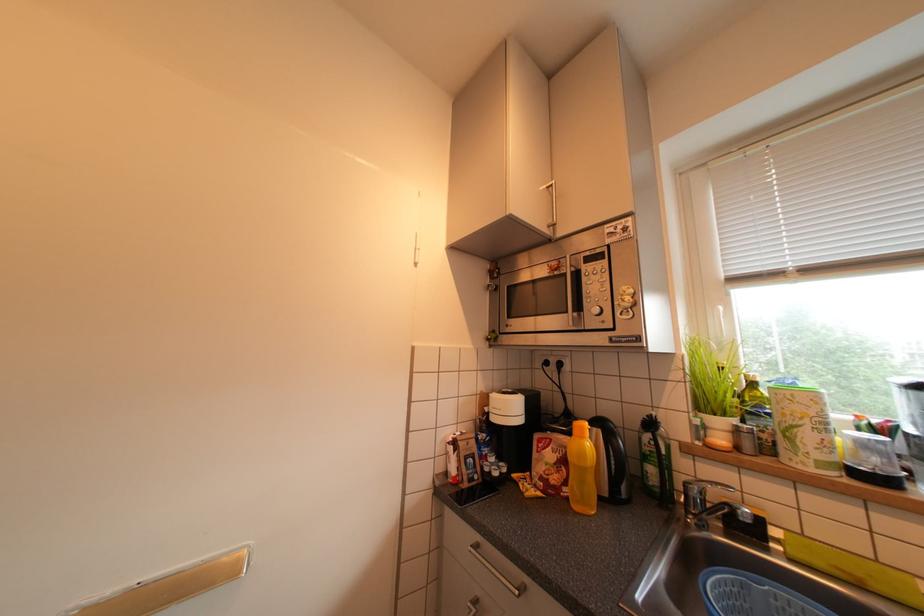
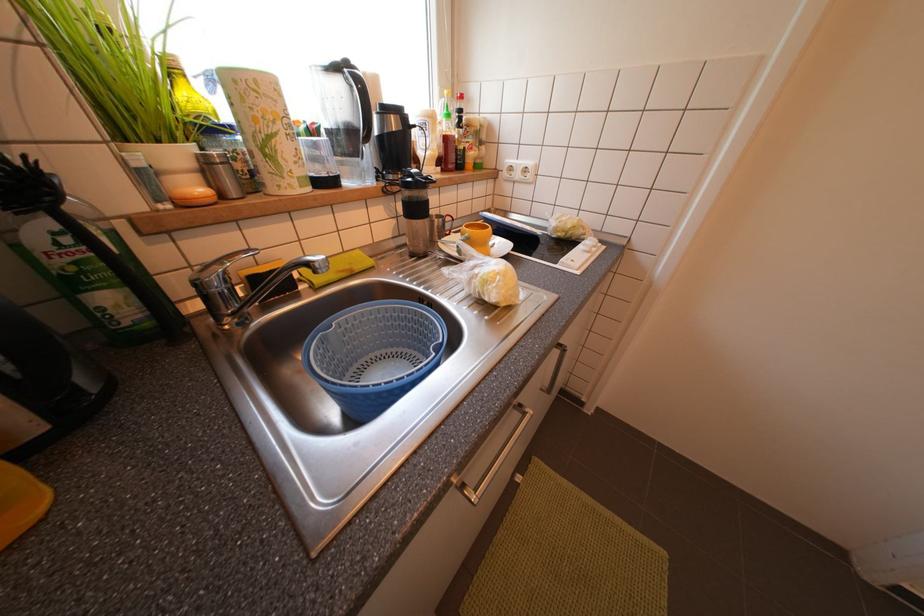
The images are taken continuously from a first-person perspective. In which direction is your viewpoint rotating?

The camera's rotation is toward right-down.